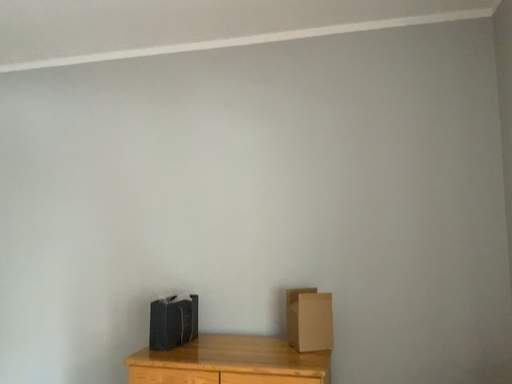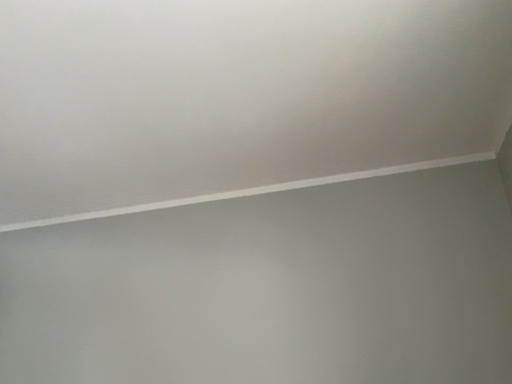
Question: Which way did the camera rotate in the video?

Choices:
 (A) rotated downward
 (B) rotated upward

Answer: (B)